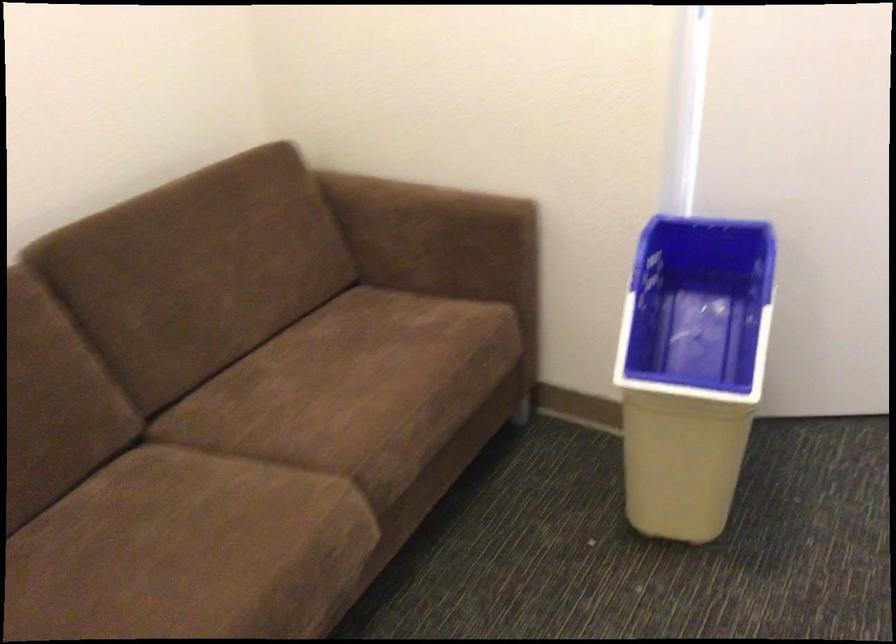
Where is `brown sofa armrest`? The image size is (896, 644). brown sofa armrest is located at coordinates (426, 216).